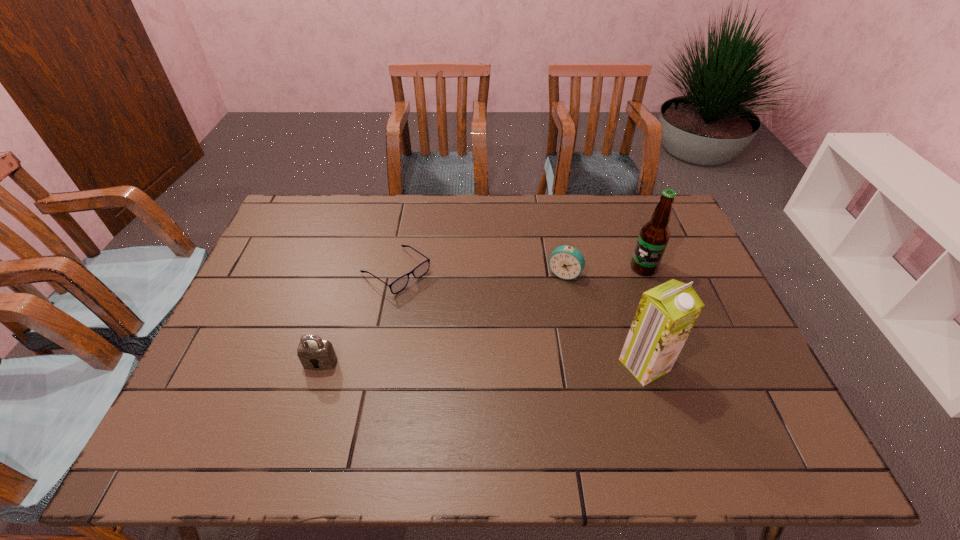
Where is `free region located 0.110m on the label of the beer bottle`? This screenshot has height=540, width=960. free region located 0.110m on the label of the beer bottle is located at coordinates (607, 286).

Identify the location of vacant area situated 0.330m on the label of the beer bottle. (548, 316).

Identify the location of vacant space situated 0.400m on the label of the beer bottle. (528, 326).

Locate an element on the screen. vacant space positioned on the front-facing side of the shortest object is located at coordinates (519, 362).

At what (x,y) coordinates should I click in order to perform the action: click on free space located on the front-facing side of the shortest object. Please return your answer as a coordinate pair (x, y). Looking at the image, I should click on pyautogui.click(x=447, y=310).

At what (x,y) coordinates should I click in order to perform the action: click on vacant area located on the front-facing side of the shortest object. Please return your answer as a coordinate pair (x, y). Looking at the image, I should click on (485, 336).

Find the location of `object present at the near edge`. object present at the near edge is located at coordinates pyautogui.click(x=666, y=314).

Find the location of a particular element. The width and height of the screenshot is (960, 540). object situated at the right edge is located at coordinates (654, 235).

Where is `vacant region at the far edge of the desktop`? Image resolution: width=960 pixels, height=540 pixels. vacant region at the far edge of the desktop is located at coordinates (556, 217).

In the image, there is a desktop. Where is `vacant space at the near edge`? The width and height of the screenshot is (960, 540). vacant space at the near edge is located at coordinates (419, 396).